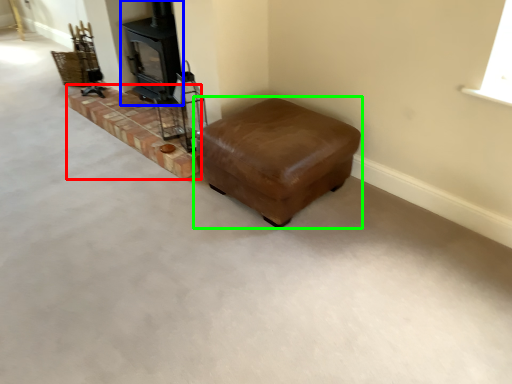
Question: Estimate the real-world distances between objects in this image. Which object is closer to stairwell (highlighted by a red box), wood burning stove (highlighted by a blue box) or furniture (highlighted by a green box)?

Choices:
 (A) wood burning stove
 (B) furniture

Answer: (A)